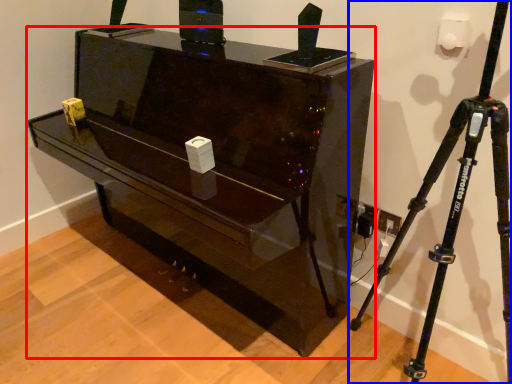
Question: Which object is closer to the camera taking this photo, furniture (highlighted by a red box) or tripod (highlighted by a blue box)?

Choices:
 (A) furniture
 (B) tripod

Answer: (B)